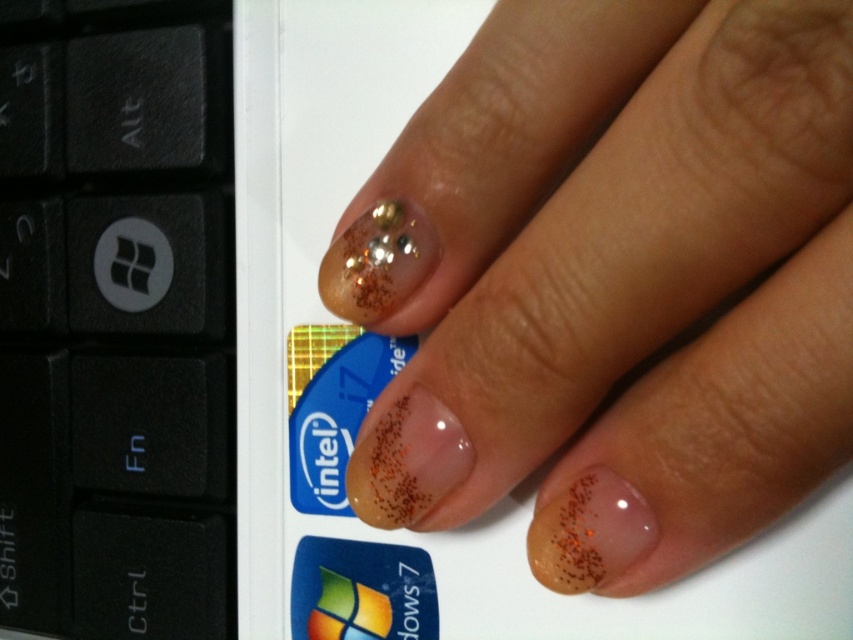
Where is `clear gel nails at center`? clear gel nails at center is located at coordinates (619, 280).

In the scene shown: Who is shorter, clear gel nails at center or black plastic keyboard at left?

Standing shorter between the two is clear gel nails at center.

The width and height of the screenshot is (853, 640). I want to click on clear gel nails at center, so click(x=619, y=280).